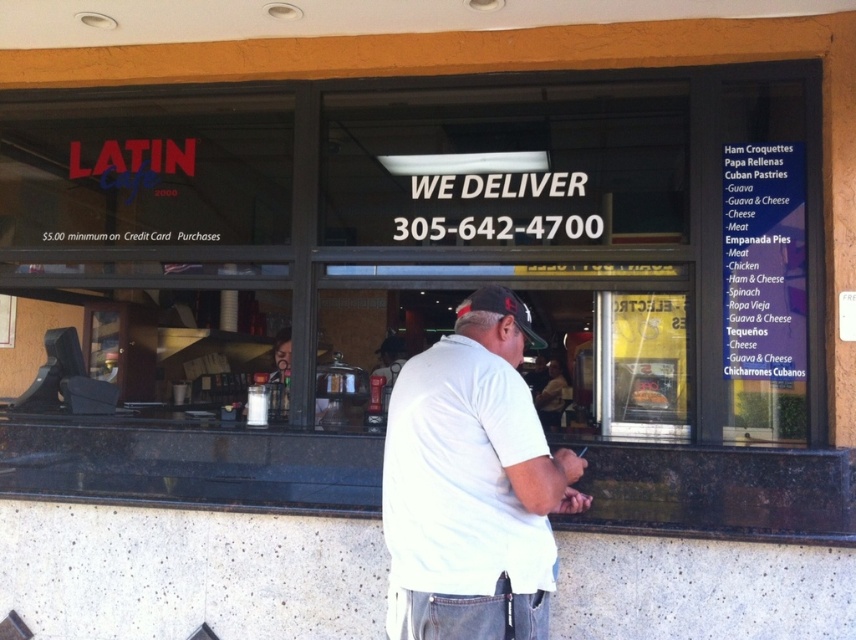
Does white cotton shirt at center have a larger size compared to black fabric baseball cap at center?

Indeed, white cotton shirt at center has a larger size compared to black fabric baseball cap at center.

Which is above, white cotton shirt at center or black fabric baseball cap at center?

black fabric baseball cap at center is higher up.

This screenshot has height=640, width=856. I want to click on white cotton shirt at center, so 473,483.